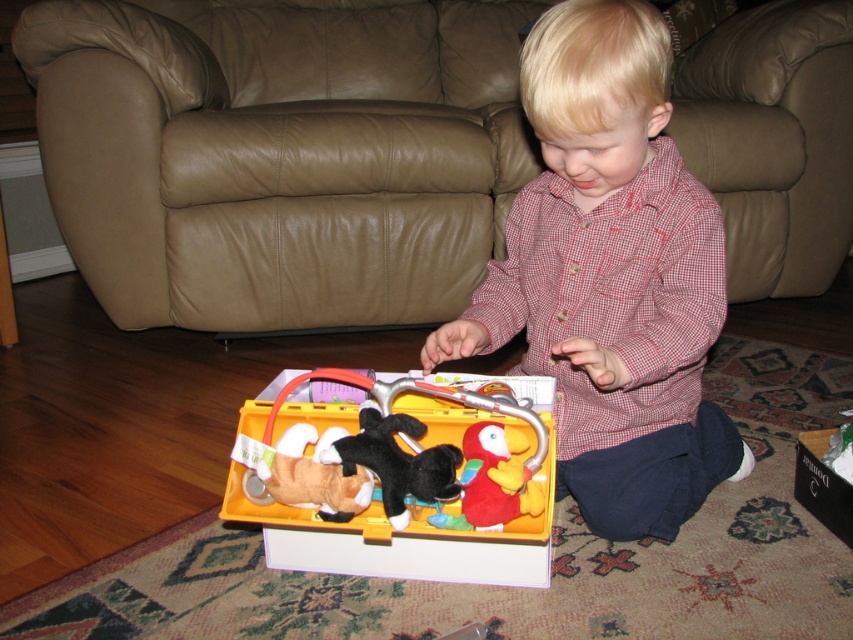
Question: Which object appears farthest from the camera in this image?

Choices:
 (A) yellow plastic toolbox at center
 (B) red checkered shirt at center
 (C) soft plush fox at center

Answer: (C)

Question: Is black plush toy at center below cardboard box at lower right?

Choices:
 (A) yes
 (B) no

Answer: (B)

Question: In this image, where is soft plush fox at center located relative to velvet plush parrot at center?

Choices:
 (A) left
 (B) right

Answer: (A)

Question: Which of these objects is positioned farthest from the black plush toy at center?

Choices:
 (A) yellow plastic toolbox at center
 (B) brown leather armchair at center
 (C) soft plush fox at center

Answer: (B)

Question: Is brown leather armchair at center behind red checkered shirt at center?

Choices:
 (A) no
 (B) yes

Answer: (B)

Question: Which point appears closest to the camera in this image?

Choices:
 (A) (326, 432)
 (B) (367, 99)
 (C) (293, 545)

Answer: (A)